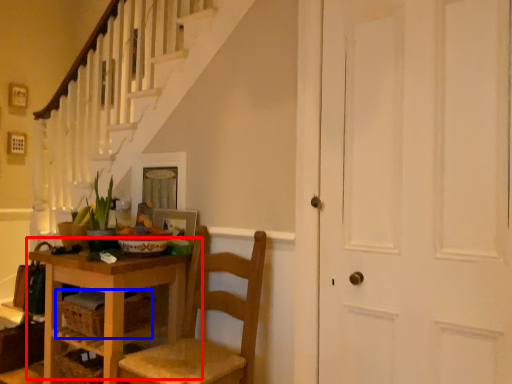
Question: Which of the following is the closest to the observer, table (highlighted by a red box) or drawer (highlighted by a blue box)?

Choices:
 (A) table
 (B) drawer

Answer: (A)